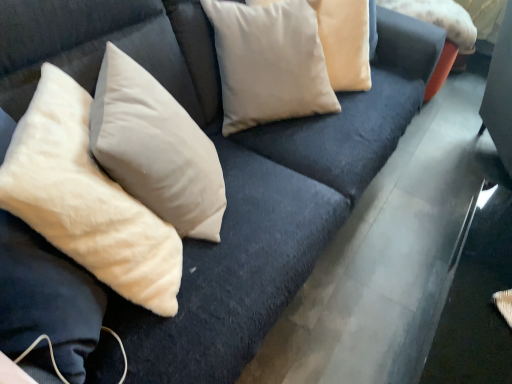
Question: Which direction should I rotate to face beige cotton pillow at upper center, which appears as the third pillow when viewed from the left, — up or down?

Choices:
 (A) down
 (B) up

Answer: (B)

Question: Is beige soft pillow at left, the first pillow from the left, positioned far away from beige cotton pillow at upper center, which appears as the third pillow when viewed from the left?

Choices:
 (A) no
 (B) yes

Answer: (B)

Question: Could you tell me if beige soft pillow at left, the 4th pillow viewed from the right, is turned towards beige cotton pillow at upper center, placed as the 2th pillow when sorted from right to left?

Choices:
 (A) no
 (B) yes

Answer: (A)

Question: Can you confirm if beige soft pillow at left, the 4th pillow viewed from the right, is shorter than beige cotton pillow at upper center, placed as the 2th pillow when sorted from right to left?

Choices:
 (A) yes
 (B) no

Answer: (B)

Question: Is beige soft pillow at left, the first pillow from the left, located outside beige cotton pillow at upper center, placed as the 2th pillow when sorted from right to left?

Choices:
 (A) no
 (B) yes

Answer: (B)

Question: Is beige soft pillow at left, the 4th pillow viewed from the right, taller than beige cotton pillow at upper center, which appears as the third pillow when viewed from the left?

Choices:
 (A) no
 (B) yes

Answer: (B)

Question: Considering the relative positions of beige soft pillow at left, the first pillow from the left, and beige cotton pillow at upper center, placed as the 2th pillow when sorted from right to left, in the image provided, is beige soft pillow at left, the first pillow from the left, behind beige cotton pillow at upper center, placed as the 2th pillow when sorted from right to left,?

Choices:
 (A) no
 (B) yes

Answer: (A)

Question: Is the depth of beige cotton pillow at upper center, placed as the 2th pillow when sorted from right to left, less than that of beige velvet pillow at upper center, acting as the 3th pillow starting from the right?

Choices:
 (A) no
 (B) yes

Answer: (A)

Question: Is beige cotton pillow at upper center, which appears as the third pillow when viewed from the left, behind beige velvet pillow at upper center, the 2th pillow viewed from the left?

Choices:
 (A) no
 (B) yes

Answer: (B)

Question: From a real-world perspective, does beige cotton pillow at upper center, placed as the 2th pillow when sorted from right to left, stand above beige velvet pillow at upper center, acting as the 3th pillow starting from the right?

Choices:
 (A) no
 (B) yes

Answer: (A)

Question: Would you say beige cotton pillow at upper center, placed as the 2th pillow when sorted from right to left, is a long distance from beige velvet pillow at upper center, acting as the 3th pillow starting from the right?

Choices:
 (A) yes
 (B) no

Answer: (B)

Question: From the image's perspective, does beige cotton pillow at upper center, which appears as the third pillow when viewed from the left, appear lower than beige velvet pillow at upper center, the 2th pillow viewed from the left?

Choices:
 (A) no
 (B) yes

Answer: (A)

Question: Can you confirm if beige cotton pillow at upper center, which appears as the third pillow when viewed from the left, is thinner than beige velvet pillow at upper center, acting as the 3th pillow starting from the right?

Choices:
 (A) no
 (B) yes

Answer: (A)

Question: Is beige cotton pillow at upper right, the fourth pillow when ordered from left to right, closer to camera compared to beige soft pillow at left, the 4th pillow viewed from the right?

Choices:
 (A) yes
 (B) no

Answer: (B)